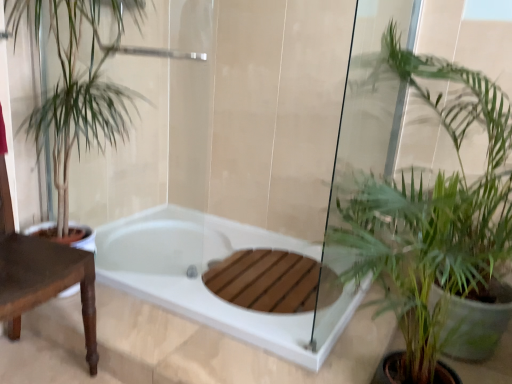
Question: Is white glossy bathtub at center thinner than brown wooden table at left?

Choices:
 (A) no
 (B) yes

Answer: (A)

Question: Can you confirm if white glossy bathtub at center is bigger than brown wooden table at left?

Choices:
 (A) yes
 (B) no

Answer: (B)

Question: From the image's perspective, is white glossy bathtub at center located above brown wooden table at left?

Choices:
 (A) yes
 (B) no

Answer: (B)

Question: Is white glossy bathtub at center not within brown wooden table at left?

Choices:
 (A) no
 (B) yes

Answer: (B)

Question: Considering the relative positions of white glossy bathtub at center and brown wooden table at left in the image provided, is white glossy bathtub at center to the right of brown wooden table at left from the viewer's perspective?

Choices:
 (A) yes
 (B) no

Answer: (A)

Question: Would you say brown wooden table at left is part of white glossy bathtub at center's contents?

Choices:
 (A) yes
 (B) no

Answer: (B)

Question: From a real-world perspective, is white glossy bathtub at center physically above green leafy plant at left, which is counted as the first houseplant, starting from the left?

Choices:
 (A) yes
 (B) no

Answer: (B)

Question: Does white glossy bathtub at center have a lesser width compared to green leafy plant at left, which is counted as the first houseplant, starting from the left?

Choices:
 (A) no
 (B) yes

Answer: (A)

Question: Is white glossy bathtub at center behind green leafy plant at left, which is counted as the first houseplant, starting from the left?

Choices:
 (A) yes
 (B) no

Answer: (A)

Question: From a real-world perspective, is white glossy bathtub at center physically below green leafy plant at left, which appears as the second houseplant when viewed from the right?

Choices:
 (A) yes
 (B) no

Answer: (A)

Question: From the image's perspective, is white glossy bathtub at center located beneath green leafy plant at left, which appears as the second houseplant when viewed from the right?

Choices:
 (A) yes
 (B) no

Answer: (A)

Question: Does white glossy bathtub at center contain green leafy plant at left, which appears as the second houseplant when viewed from the right?

Choices:
 (A) yes
 (B) no

Answer: (B)

Question: Considering the relative sizes of green leafy plant at lower right, the 2th houseplant when ordered from left to right, and green leafy plant at left, which appears as the second houseplant when viewed from the right, in the image provided, is green leafy plant at lower right, the 2th houseplant when ordered from left to right, thinner than green leafy plant at left, which appears as the second houseplant when viewed from the right,?

Choices:
 (A) no
 (B) yes

Answer: (A)